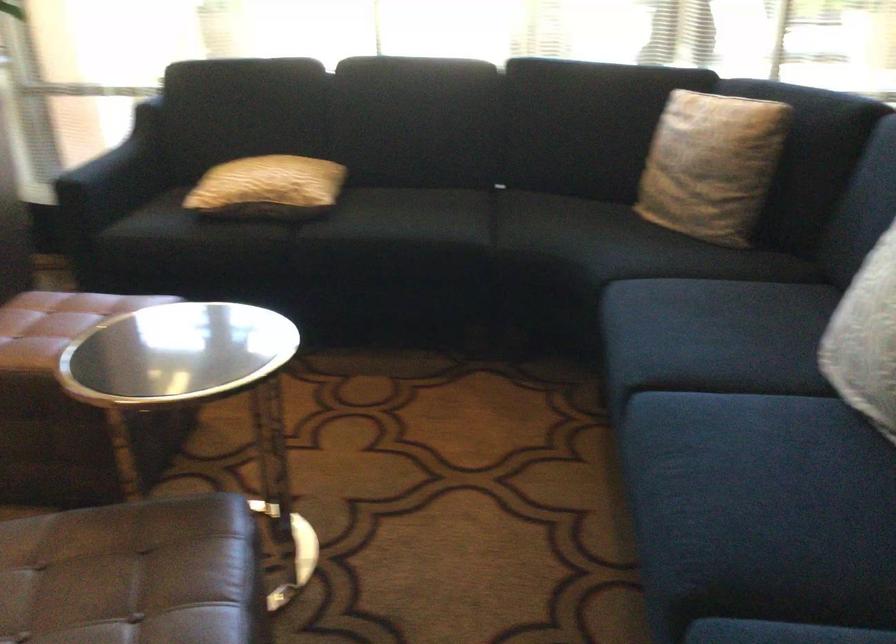
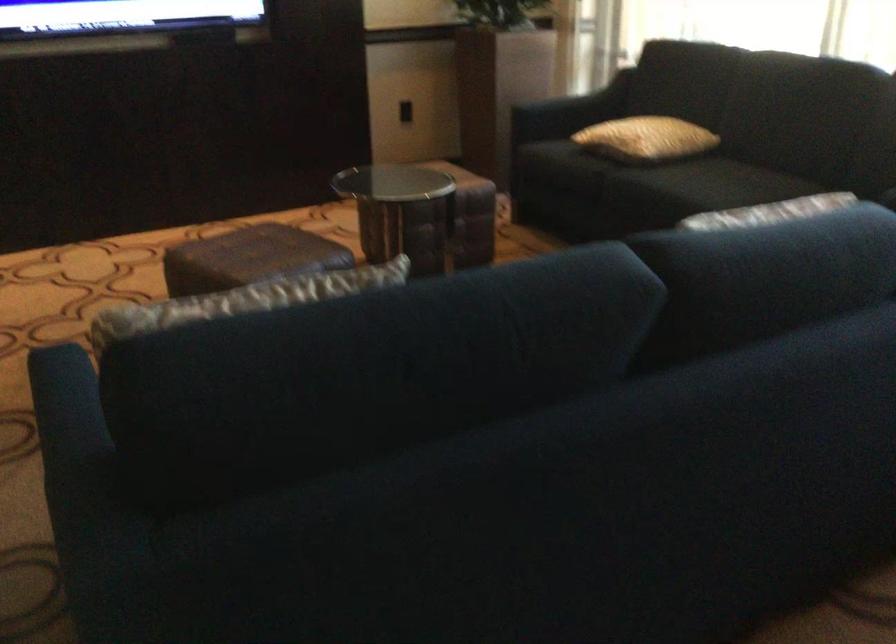
The point at (125, 156) is marked in the first image. Where is the corresponding point in the second image?

(586, 99)